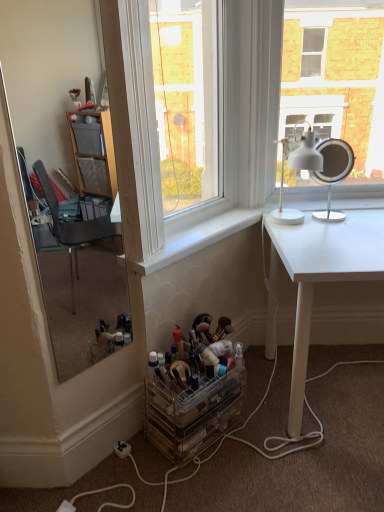
Identify the location of vacant area in front of white matte table lamp at upper right, the second table lamp positioned from the right. Image resolution: width=384 pixels, height=512 pixels. (312, 240).